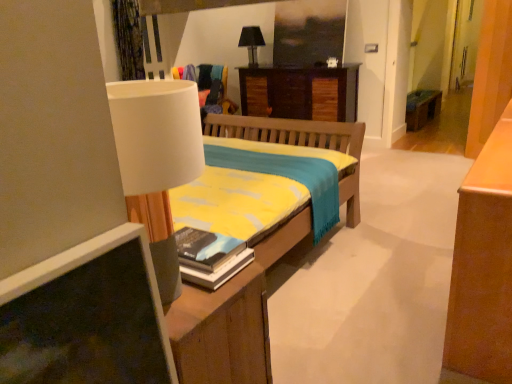
This screenshot has width=512, height=384. Describe the element at coordinates (422, 108) in the screenshot. I see `wooden bench at right` at that location.

Locate an element on the screen. The height and width of the screenshot is (384, 512). black fabric lampshade at upper center is located at coordinates (251, 42).

From the image's perspective, which is above, hardcover book at center or wooden bench at right?

wooden bench at right.

Is hardcover book at center turned away from wooden bench at right?

No.

Is hardcover book at center in contact with wooden bench at right?

No, hardcover book at center is not next to wooden bench at right.

In the image, is hardcover book at center positioned in front of or behind wooden bench at right?

hardcover book at center is in front of wooden bench at right.

Which object is thinner, black fabric lampshade at upper center or wooden desk at center?

black fabric lampshade at upper center.

Is black fabric lampshade at upper center to the left or to the right of wooden desk at center in the image?

In the image, black fabric lampshade at upper center appears on the left side of wooden desk at center.

From a real-world perspective, is black fabric lampshade at upper center positioned under wooden desk at center based on gravity?

Actually, black fabric lampshade at upper center is physically above wooden desk at center in the real world.

Would you say black fabric lampshade at upper center is a long distance from wooden desk at center?

No, black fabric lampshade at upper center is not far away from wooden desk at center.

Is wooden bench at right surrounding black fabric lampshade at upper center?

Definitely not — black fabric lampshade at upper center is not inside wooden bench at right.

Is wooden bench at right facing towards black fabric lampshade at upper center?

No, wooden bench at right is not oriented towards black fabric lampshade at upper center.

Is wooden bench at right touching black fabric lampshade at upper center?

No.

Is wooden bench at right at the right side of black fabric lampshade at upper center?

Yes, wooden bench at right is to the right of black fabric lampshade at upper center.

From the picture: Looking at their sizes, would you say wooden desk at center is wider or thinner than black fabric lampshade at upper center?

In the image, wooden desk at center appears to be wider than black fabric lampshade at upper center.

Looking at this image, from the image's perspective, is wooden desk at center beneath black fabric lampshade at upper center?

Correct, wooden desk at center appears lower than black fabric lampshade at upper center in the image.

Looking at the image, does hardcover book at center seem bigger or smaller compared to wooden desk at center?

Considering their sizes, hardcover book at center takes up less space than wooden desk at center.

Which is behind, point (230, 267) or point (301, 71)?

The point (301, 71) is more distant.

Who is bigger, wooden desk at center or hardcover book at center?

wooden desk at center is bigger.

Locate an element on the screen. The image size is (512, 384). desk on the right of hardcover book at center is located at coordinates click(x=300, y=92).

Considering the positions of objects wooden desk at center and hardcover book at center in the image provided, who is more to the left, wooden desk at center or hardcover book at center?

hardcover book at center.

Is the position of wooden desk at center more distant than that of hardcover book at center?

Yes, wooden desk at center is behind hardcover book at center.

Which is less distant, (255, 45) or (410, 106)?

Point (255, 45) is positioned closer to the camera compared to point (410, 106).

Considering the sizes of black fabric lampshade at upper center and wooden bench at right in the image, is black fabric lampshade at upper center bigger or smaller than wooden bench at right?

Considering their sizes, black fabric lampshade at upper center takes up less space than wooden bench at right.

Which is more to the left, black fabric lampshade at upper center or wooden bench at right?

From the viewer's perspective, black fabric lampshade at upper center appears more on the left side.

From the image's perspective, is black fabric lampshade at upper center above or below wooden bench at right?

Based on their image positions, black fabric lampshade at upper center is located above wooden bench at right.

The height and width of the screenshot is (384, 512). I want to click on table lying behind the hardcover book at center, so click(x=422, y=108).

Find the location of a particular element. This screenshot has height=384, width=512. desk directly beneath the black fabric lampshade at upper center (from a real-world perspective) is located at coordinates (300, 92).

Based on their spatial positions, is wooden bench at right or black fabric lampshade at upper center closer to wooden desk at center?

Based on the image, black fabric lampshade at upper center appears to be nearer to wooden desk at center.

Estimate the real-world distances between objects in this image. Which object is further from wooden desk at center, black fabric lampshade at upper center or wooden bench at right?

wooden bench at right lies further to wooden desk at center than the other object.

When comparing their distances from wooden desk at center, does hardcover book at center or wooden bench at right seem closer?

wooden bench at right is closer to wooden desk at center.

Based on the photo, when comparing their distances from wooden bench at right, does hardcover book at center or black fabric lampshade at upper center seem further?

Based on the image, hardcover book at center appears to be further to wooden bench at right.

Estimate the real-world distances between objects in this image. Which object is further from hardcover book at center, wooden desk at center or wooden bench at right?

wooden bench at right lies further to hardcover book at center than the other object.

In the scene shown: When comparing their distances from hardcover book at center, does wooden desk at center or black fabric lampshade at upper center seem further?

Based on the image, black fabric lampshade at upper center appears to be further to hardcover book at center.

When comparing their distances from black fabric lampshade at upper center, does hardcover book at center or wooden bench at right seem further?

hardcover book at center lies further to black fabric lampshade at upper center than the other object.

Which object lies further to the anchor point black fabric lampshade at upper center, hardcover book at center or wooden desk at center?

The object further to black fabric lampshade at upper center is hardcover book at center.

The width and height of the screenshot is (512, 384). Find the location of `table lamp between hardcover book at center and wooden bench at right along the z-axis`. table lamp between hardcover book at center and wooden bench at right along the z-axis is located at coordinates (251, 42).

Find the location of a particular element. The height and width of the screenshot is (384, 512). desk located between hardcover book at center and black fabric lampshade at upper center in the depth direction is located at coordinates coord(300,92).

Image resolution: width=512 pixels, height=384 pixels. Identify the location of desk between hardcover book at center and wooden bench at right from front to back. (300, 92).

This screenshot has width=512, height=384. Find the location of `desk between black fabric lampshade at upper center and wooden bench at right`. desk between black fabric lampshade at upper center and wooden bench at right is located at coordinates (300, 92).